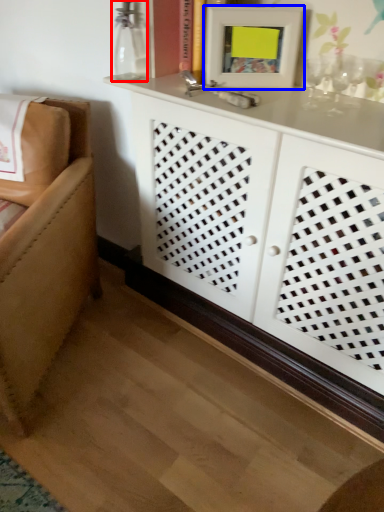
Question: Which point is closer to the camera, glass vase (highlighted by a red box) or picture frame (highlighted by a blue box)?

Choices:
 (A) glass vase
 (B) picture frame

Answer: (B)